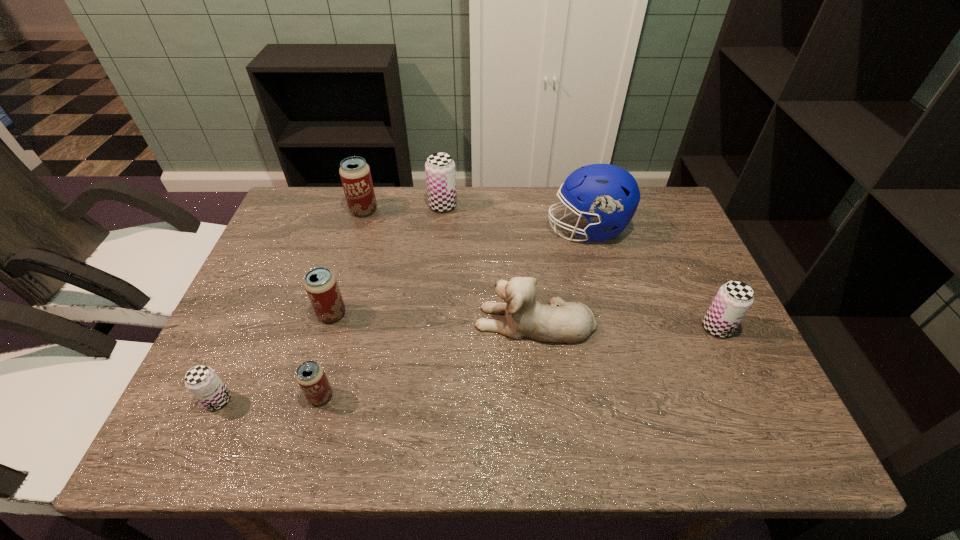
The height and width of the screenshot is (540, 960). I want to click on the nearest purple beer can, so click(202, 381).

Find the location of a particular element. Image resolution: width=960 pixels, height=540 pixels. the smallest red beer can is located at coordinates (310, 375).

Locate an element on the screen. vacant space located on the front-facing side of the football helmet is located at coordinates (444, 230).

The image size is (960, 540). Find the location of `free space located on the front-facing side of the football helmet`. free space located on the front-facing side of the football helmet is located at coordinates (447, 230).

At what (x,y) coordinates should I click in order to perform the action: click on blank space located 0.380m on the front-facing side of the football helmet. Please return your answer as a coordinate pair (x, y). This screenshot has width=960, height=540. Looking at the image, I should click on (417, 230).

Where is `free region located on the left of the biggest red beer can`? This screenshot has width=960, height=540. free region located on the left of the biggest red beer can is located at coordinates (285, 210).

Locate an element on the screen. Image resolution: width=960 pixels, height=540 pixels. vacant region located on the right of the second beer can from right to left is located at coordinates (476, 206).

Where is `vacant space located on the front-facing side of the puppy`? vacant space located on the front-facing side of the puppy is located at coordinates (307, 321).

Where is `vacant space situated 0.230m on the front-facing side of the puppy`? vacant space situated 0.230m on the front-facing side of the puppy is located at coordinates (378, 321).

Where is `free location located on the front-facing side of the puppy`? The width and height of the screenshot is (960, 540). free location located on the front-facing side of the puppy is located at coordinates (311, 321).